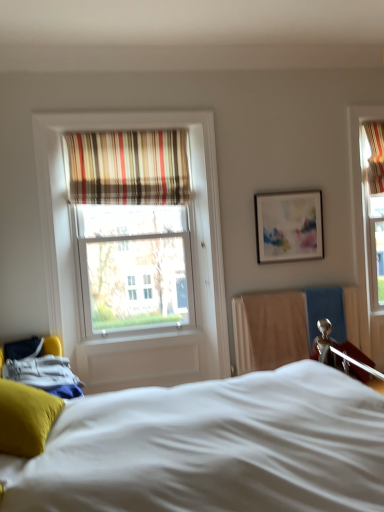
Question: Is white soft bed at center behind matte white picture frame at upper right?

Choices:
 (A) no
 (B) yes

Answer: (A)

Question: Is white soft bed at center facing towards matte white picture frame at upper right?

Choices:
 (A) yes
 (B) no

Answer: (B)

Question: From a real-world perspective, does white soft bed at center sit lower than matte white picture frame at upper right?

Choices:
 (A) yes
 (B) no

Answer: (A)

Question: Considering the relative sizes of white soft bed at center and matte white picture frame at upper right in the image provided, is white soft bed at center smaller than matte white picture frame at upper right?

Choices:
 (A) no
 (B) yes

Answer: (A)

Question: Does white soft bed at center have a greater height compared to matte white picture frame at upper right?

Choices:
 (A) no
 (B) yes

Answer: (B)

Question: Is white soft bed at center in front of or behind striped fabric curtain at upper center in the image?

Choices:
 (A) behind
 (B) front

Answer: (B)

Question: Is white soft bed at center inside or outside of striped fabric curtain at upper center?

Choices:
 (A) inside
 (B) outside

Answer: (B)

Question: From their relative heights in the image, would you say white soft bed at center is taller or shorter than striped fabric curtain at upper center?

Choices:
 (A) tall
 (B) short

Answer: (A)

Question: Based on their sizes in the image, would you say white soft bed at center is bigger or smaller than striped fabric curtain at upper center?

Choices:
 (A) small
 (B) big

Answer: (B)

Question: From a real-world perspective, is white soft bed at center positioned above or below soft yellow pillow at lower left?

Choices:
 (A) below
 (B) above

Answer: (A)

Question: Relative to soft yellow pillow at lower left, is white soft bed at center in front or behind?

Choices:
 (A) behind
 (B) front

Answer: (B)

Question: Is white soft bed at center wider or thinner than soft yellow pillow at lower left?

Choices:
 (A) wide
 (B) thin

Answer: (A)

Question: Based on their sizes in the image, would you say white soft bed at center is bigger or smaller than soft yellow pillow at lower left?

Choices:
 (A) big
 (B) small

Answer: (A)

Question: Considering the positions of striped fabric curtain at upper center and white soft bed at center in the image, is striped fabric curtain at upper center bigger or smaller than white soft bed at center?

Choices:
 (A) big
 (B) small

Answer: (B)

Question: From a real-world perspective, is striped fabric curtain at upper center above or below white soft bed at center?

Choices:
 (A) below
 (B) above

Answer: (B)